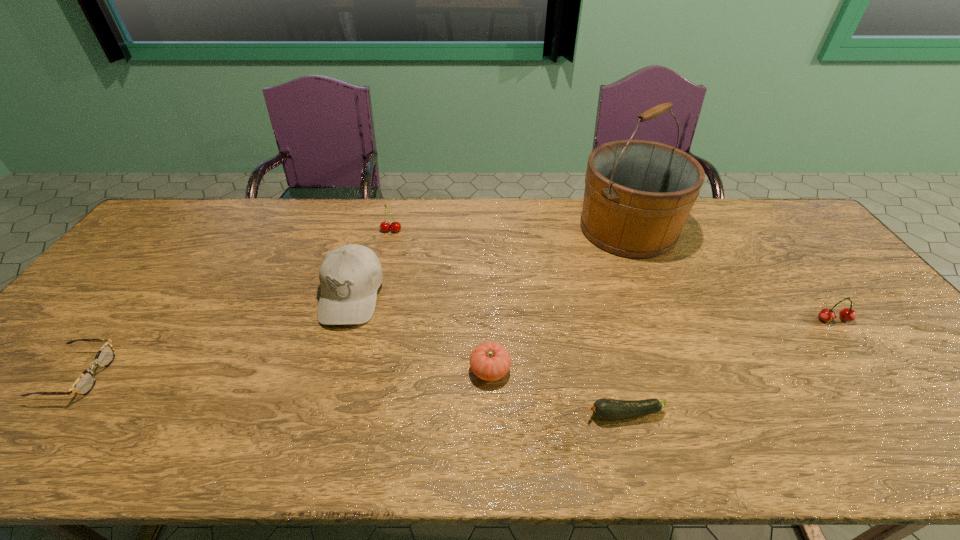
This screenshot has width=960, height=540. Find the location of `object that is at the near edge`. object that is at the near edge is located at coordinates (606, 409).

I want to click on object present at the left edge, so click(86, 381).

Locate an element on the screen. This screenshot has height=540, width=960. object located at the right edge is located at coordinates (847, 314).

At what (x,y) coordinates should I click in order to perform the action: click on vacant area at the far edge. Please return your answer as a coordinate pair (x, y). The width and height of the screenshot is (960, 540). Looking at the image, I should click on (472, 224).

Identify the location of vacant position at the near edge of the desktop. (749, 435).

Image resolution: width=960 pixels, height=540 pixels. I want to click on blank space at the left edge of the desktop, so click(126, 314).

Identify the location of vacant space at the right edge. (820, 271).

The width and height of the screenshot is (960, 540). Find the location of `vacant space at the far left corner of the desktop`. vacant space at the far left corner of the desktop is located at coordinates (206, 206).

Find the location of a particular element. vacant space that is in between the tallest object and the fifth tallest object is located at coordinates (559, 299).

Identify the location of free area in between the tallest object and the baseball cap. (490, 262).